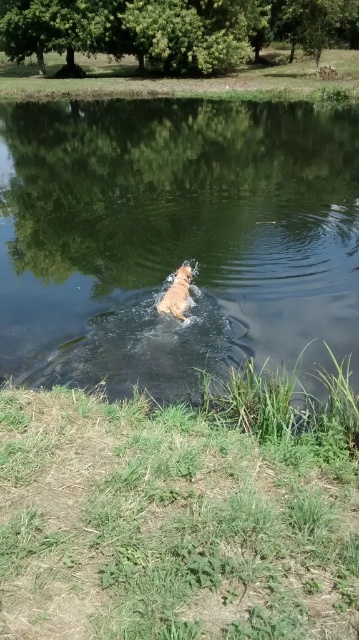
Is point (171, 336) positioned in front of point (175, 307)?

That is False.

Who is more forward, (x=357, y=208) or (x=164, y=312)?

Point (x=164, y=312) is more forward.

Locate an element on the screen. Image resolution: width=359 pixels, height=640 pixels. clear water at center is located at coordinates (174, 240).